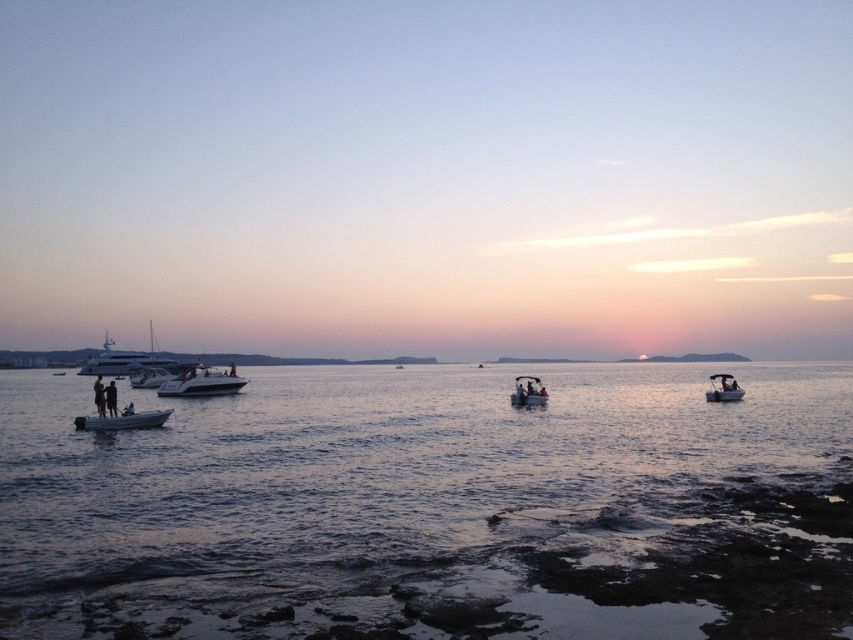
From the picture: Does shiny silver speedboat at left have a smaller size compared to white glossy boat at left?

No.

Image resolution: width=853 pixels, height=640 pixels. I want to click on shiny silver speedboat at left, so point(201,384).

Which is behind, point (210, 394) or point (164, 368)?

Positioned behind is point (164, 368).

The height and width of the screenshot is (640, 853). Identify the location of shiny silver speedboat at left. (201, 384).

Is shiny silver yacht at left shorter than metallic silver dinghy at center right?

Incorrect, shiny silver yacht at left's height does not fall short of metallic silver dinghy at center right's.

Does point (138, 368) come behind point (711, 394)?

Yes, point (138, 368) is farther from viewer.

Which is behind, point (80, 369) or point (717, 394)?

Point (80, 369)

Identify the location of shiny silver yacht at left. Image resolution: width=853 pixels, height=640 pixels. (114, 360).

At what (x,y) coordinates should I click in order to perform the action: click on shiny silver yacht at left. Please return your answer as a coordinate pair (x, y). The image size is (853, 640). Looking at the image, I should click on (114, 360).

Does shiny silver yacht at left appear on the right side of metallic silver boat at center?

Incorrect, shiny silver yacht at left is not on the right side of metallic silver boat at center.

This screenshot has width=853, height=640. What are the coordinates of `shiny silver yacht at left` in the screenshot? It's located at (114, 360).